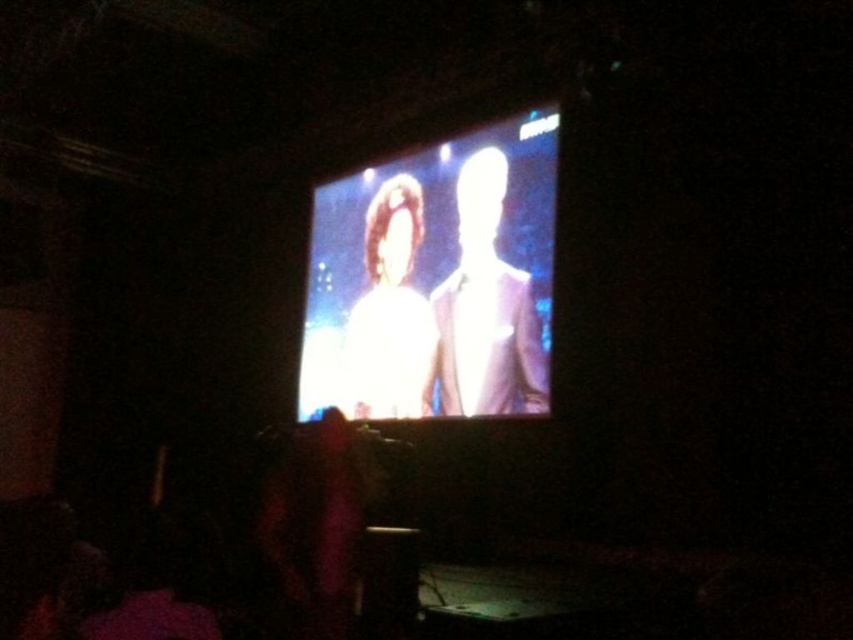
Is white glossy suit at center below white glossy shirt at center?

Incorrect, white glossy suit at center is not positioned below white glossy shirt at center.

Can you confirm if white glossy suit at center is thinner than white glossy shirt at center?

Yes, white glossy suit at center is thinner than white glossy shirt at center.

Measure the distance between point (463, 403) and camera.

5.12 meters

Where is `white glossy suit at center`? white glossy suit at center is located at coordinates (486, 308).

Is bright glossy screen at center to the right of white glossy shirt at center from the viewer's perspective?

Indeed, bright glossy screen at center is positioned on the right side of white glossy shirt at center.

Does point (524, 198) come behind point (381, 228)?

That is False.

This screenshot has height=640, width=853. In order to click on bright glossy screen at center in this screenshot , I will do `click(434, 280)`.

Is bright glossy screen at center shorter than white glossy suit at center?

No.

Is point (399, 317) behind point (520, 339)?

That is True.

The height and width of the screenshot is (640, 853). In order to click on bright glossy screen at center in this screenshot , I will do `click(434, 280)`.